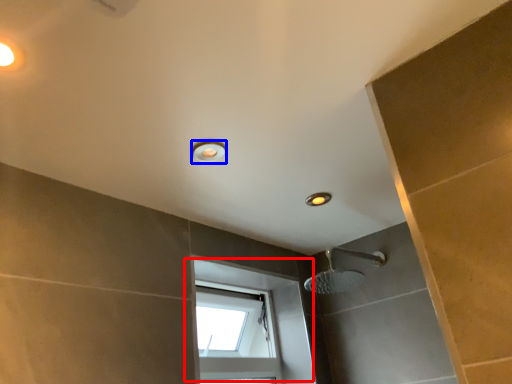
Question: Which object is further to the camera taking this photo, window (highlighted by a red box) or light fixture (highlighted by a blue box)?

Choices:
 (A) window
 (B) light fixture

Answer: (A)